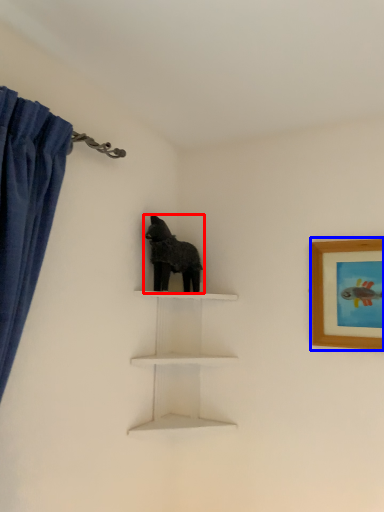
Question: Which object is closer to the camera taking this photo, animal (highlighted by a red box) or picture frame (highlighted by a blue box)?

Choices:
 (A) animal
 (B) picture frame

Answer: (B)